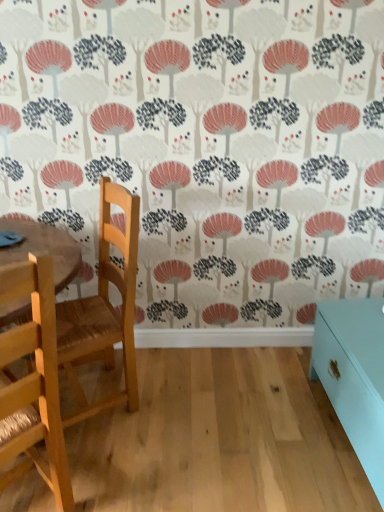
Question: From the image's perspective, is wooden chair at left, which is counted as the first chair, starting from the back, below light wood chair at left, the second chair positioned from the back?

Choices:
 (A) yes
 (B) no

Answer: (B)

Question: Is wooden chair at left, which is counted as the first chair, starting from the back, positioned before light wood chair at left, the second chair positioned from the back?

Choices:
 (A) no
 (B) yes

Answer: (A)

Question: Considering the relative sizes of wooden chair at left, which is counted as the first chair, starting from the back, and light wood chair at left, arranged as the 1th chair when viewed from the front, in the image provided, is wooden chair at left, which is counted as the first chair, starting from the back, wider than light wood chair at left, arranged as the 1th chair when viewed from the front,?

Choices:
 (A) yes
 (B) no

Answer: (B)

Question: Is wooden chair at left, which is counted as the first chair, starting from the back, oriented towards light wood chair at left, the second chair positioned from the back?

Choices:
 (A) yes
 (B) no

Answer: (B)

Question: Is wooden chair at left, which appears as the second chair when viewed from the front, surrounding light wood chair at left, arranged as the 1th chair when viewed from the front?

Choices:
 (A) yes
 (B) no

Answer: (B)

Question: Can you confirm if wooden chair at left, which appears as the second chair when viewed from the front, is bigger than light wood chair at left, arranged as the 1th chair when viewed from the front?

Choices:
 (A) no
 (B) yes

Answer: (B)

Question: From the image's perspective, would you say light wood chair at left, arranged as the 1th chair when viewed from the front, is shown under teal glossy cabinet at lower right?

Choices:
 (A) yes
 (B) no

Answer: (B)

Question: Can you confirm if light wood chair at left, arranged as the 1th chair when viewed from the front, is positioned to the left of teal glossy cabinet at lower right?

Choices:
 (A) yes
 (B) no

Answer: (A)

Question: Is light wood chair at left, the second chair positioned from the back, positioned behind teal glossy cabinet at lower right?

Choices:
 (A) no
 (B) yes

Answer: (A)

Question: Is light wood chair at left, the second chair positioned from the back, in front of teal glossy cabinet at lower right?

Choices:
 (A) no
 (B) yes

Answer: (B)

Question: Is light wood chair at left, arranged as the 1th chair when viewed from the front, smaller than teal glossy cabinet at lower right?

Choices:
 (A) no
 (B) yes

Answer: (B)

Question: Is light wood chair at left, the second chair positioned from the back, looking in the opposite direction of teal glossy cabinet at lower right?

Choices:
 (A) yes
 (B) no

Answer: (B)

Question: Is the position of teal glossy cabinet at lower right less distant than that of light wood chair at left, arranged as the 1th chair when viewed from the front?

Choices:
 (A) no
 (B) yes

Answer: (A)